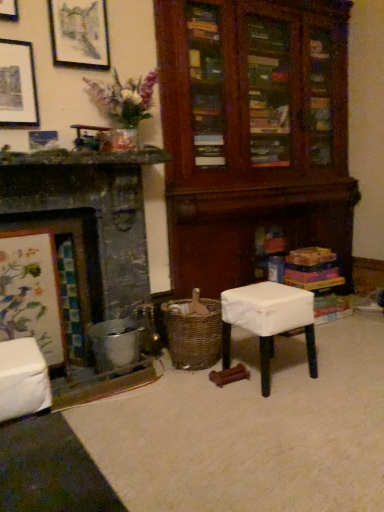
Image resolution: width=384 pixels, height=512 pixels. What are the coordinates of `vacant space in front of metallic silver fireplace at left` in the screenshot? It's located at (135, 436).